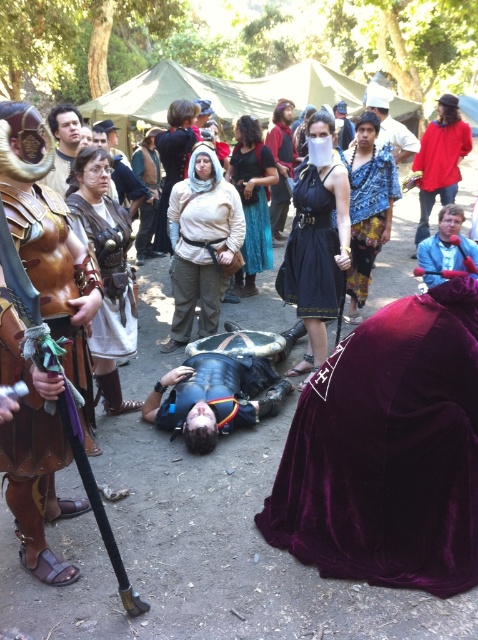
You are an event organizer at the medieval festival and need to ensure that all decorations are properly arranged. You have a flagpole that is 1.5 meters tall. You want to hang the red cotton shirt at upper right and the matte black mask at center on the flagpole. Can both items be displayed without overlapping each other?

The red cotton shirt at upper right is taller than the matte black mask at center. Since the flagpole is 1.5 meters tall, you can arrange them vertically so that the taller red cotton shirt at upper right is placed above the shorter matte black mask at center, ensuring they do not overlap.

You are a photographer at the medieval event. You need to capture a photo that includes both the leather armor at center and the red cotton shirt at upper right. Based on their positions, which one should be placed on the left side of the photo to maintain their original arrangement?

The leather armor at center should be placed on the left side of the photo because it is positioned on the left side of the red cotton shirt at upper right in the original scene.